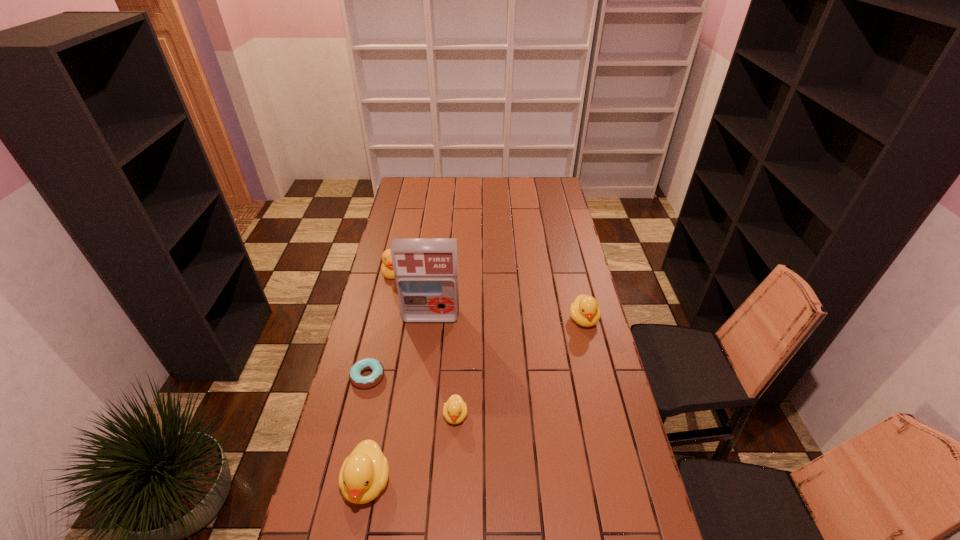
In order to click on vacant area located 0.270m on the beak of the second nearest duckling in this screenshot , I will do `click(450, 524)`.

Image resolution: width=960 pixels, height=540 pixels. What are the coordinates of `vacant space located on the beak of the second shortest duckling` in the screenshot? It's located at (605, 406).

The width and height of the screenshot is (960, 540). I want to click on free space located at the beak of the farthest object, so 384,314.

Identify the location of vacant space located 0.390m on the right of the fourth farthest object. (499, 376).

The width and height of the screenshot is (960, 540). What are the coordinates of `free spot located 0.330m on the front-facing side of the first-aid kit` in the screenshot? It's located at (421, 398).

Where is `object that is at the near edge`? object that is at the near edge is located at coordinates (364, 473).

Where is `duckling situated at the left edge`? duckling situated at the left edge is located at coordinates (364, 473).

Where is `duck that is at the left edge`? Image resolution: width=960 pixels, height=540 pixels. duck that is at the left edge is located at coordinates (387, 270).

Where is `doughnut that is at the left edge`? The width and height of the screenshot is (960, 540). doughnut that is at the left edge is located at coordinates (356, 378).

Image resolution: width=960 pixels, height=540 pixels. What are the coordinates of `the first-aid kit that is at the left edge` in the screenshot? It's located at (426, 270).